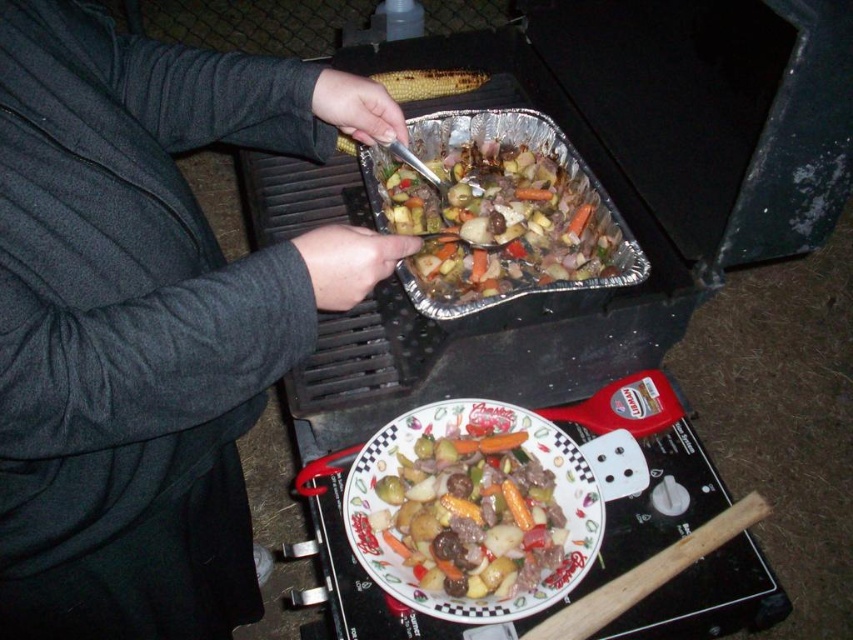
You are setting up a table for a dinner party and need to place the dark gray sweater at upper left and the decorative ceramic plate at center. Based on their sizes, which item should you place first to ensure both fit comfortably on the table?

The dark gray sweater at upper left might be wider than decorative ceramic plate at center, so you should place the dark gray sweater at upper left first to accommodate its width before placing the decorative ceramic plate at center.

You are setting up a table for a dinner party and need to place the dark gray sweater at upper left and the decorative ceramic plate at center. According to the scene, which object should be placed to the left side of the table?

The dark gray sweater at upper left should be placed to the left side of the table because it is located to the left of the decorative ceramic plate at center in the scene.

You are setting up a night market stall and need to place the decorative ceramic plate at center and the grilled yellow corn at upper center on a small shelf. The shelf can only hold items that are not overlapping. Can you fit both items on the shelf without overlapping?

The decorative ceramic plate at center is in front of the grilled yellow corn at upper center, so they are overlapping. Therefore, you cannot fit both items on the shelf without overlapping.